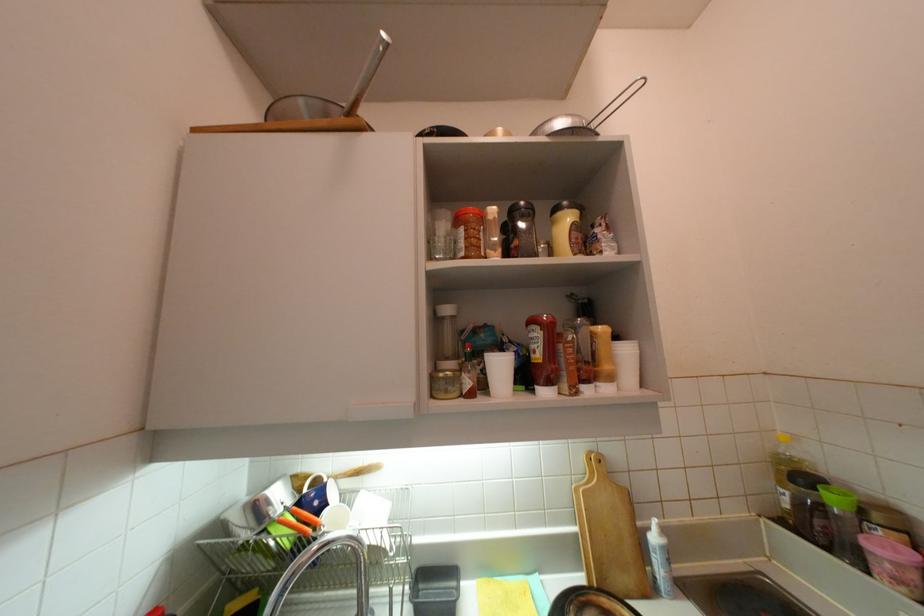
I want to click on blue mug handle, so click(x=314, y=479).